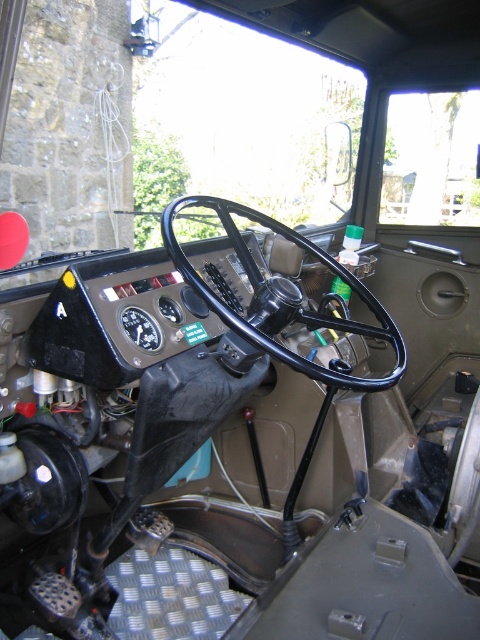
Does transparent glass windshield at upper center have a greater width compared to black rubber steering wheel at center?

Yes, transparent glass windshield at upper center is wider than black rubber steering wheel at center.

Does transparent glass windshield at upper center have a smaller size compared to black rubber steering wheel at center?

No, transparent glass windshield at upper center is not smaller than black rubber steering wheel at center.

Identify the location of transparent glass windshield at upper center. (168, 122).

Where is `transparent glass windshield at upper center`? This screenshot has height=640, width=480. transparent glass windshield at upper center is located at coordinates (168, 122).